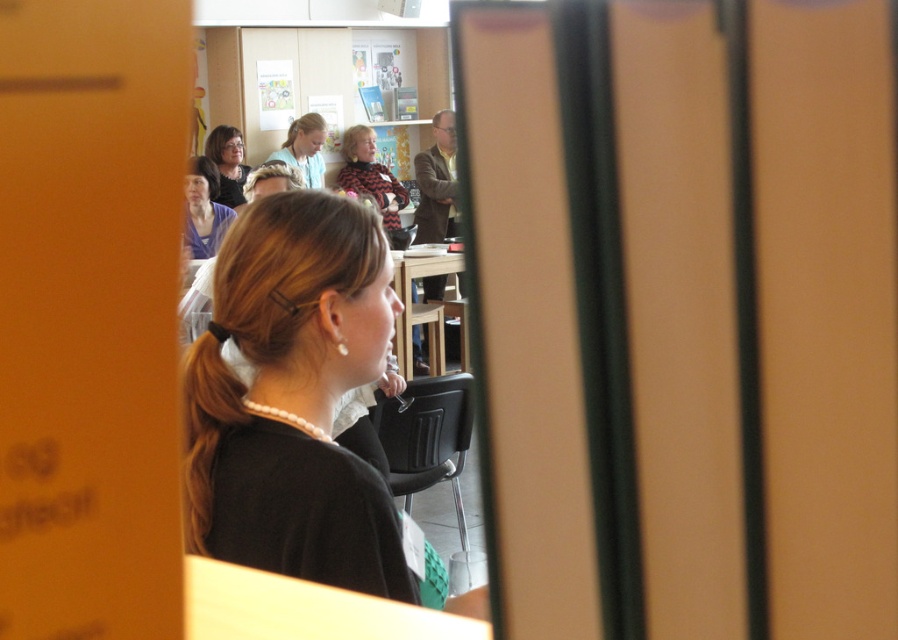
Question: Which point is farther to the camera?

Choices:
 (A) click(x=233, y=205)
 (B) click(x=192, y=156)
 (C) click(x=310, y=468)
 (D) click(x=349, y=170)

Answer: (D)

Question: Can you confirm if black textured sweater at center is thinner than matte black sweater at upper left?

Choices:
 (A) yes
 (B) no

Answer: (B)

Question: Is black matte shirt at center thinner than matte purple blouse at upper left?

Choices:
 (A) yes
 (B) no

Answer: (A)

Question: Which of the following is the farthest from the observer?

Choices:
 (A) (439, 339)
 (B) (304, 140)
 (C) (188, 252)
 (D) (355, 129)

Answer: (D)

Question: Which point is closer to the camera?

Choices:
 (A) matte purple blouse at upper left
 (B) wooden at center
 (C) black matte shirt at center
 (D) matte blue shirt at upper center

Answer: (C)

Question: Does matte purple blouse at upper left have a greater width compared to matte black sweater at upper left?

Choices:
 (A) yes
 (B) no

Answer: (A)